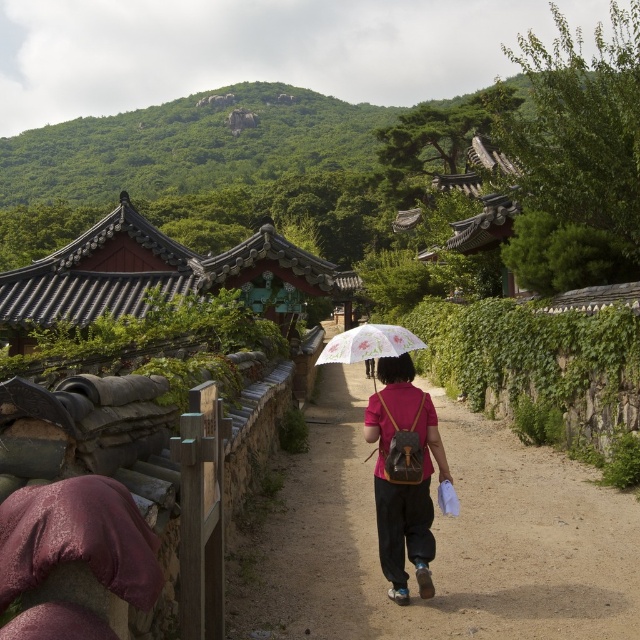
Question: Estimate the real-world distances between objects in this image. Which object is farther from the transparent floral-patterned umbrella at center?

Choices:
 (A) brown dirt path at center
 (B) matte pink shirt at center

Answer: (A)

Question: Is brown dirt path at center thinner than transparent floral-patterned umbrella at center?

Choices:
 (A) no
 (B) yes

Answer: (A)

Question: Which object appears closest to the camera in this image?

Choices:
 (A) transparent floral-patterned umbrella at center
 (B) matte pink shirt at center

Answer: (B)

Question: Can you confirm if brown dirt path at center is wider than transparent floral-patterned umbrella at center?

Choices:
 (A) no
 (B) yes

Answer: (B)

Question: Based on their relative distances, which object is nearer to the matte pink shirt at center?

Choices:
 (A) brown dirt path at center
 (B) transparent floral-patterned umbrella at center

Answer: (B)

Question: Is brown dirt path at center positioned in front of matte pink shirt at center?

Choices:
 (A) no
 (B) yes

Answer: (B)